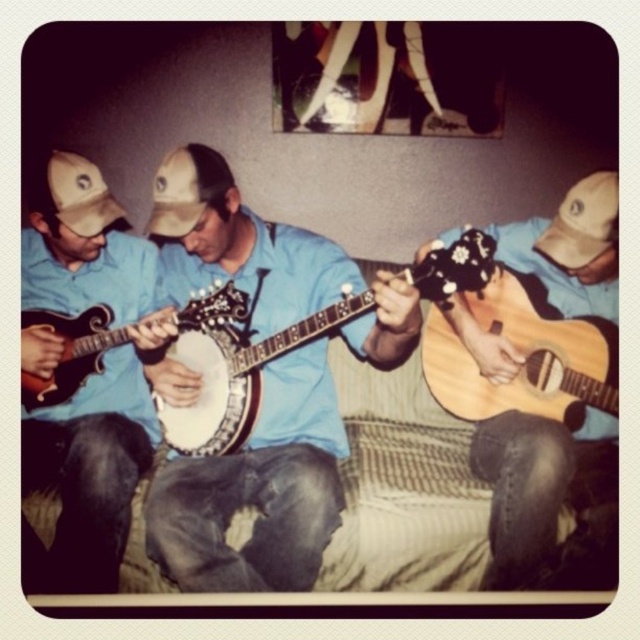
Does matte white banjo at center appear on the left side of tan fabric baseball cap at upper right?

Correct, you'll find matte white banjo at center to the left of tan fabric baseball cap at upper right.

Is point (36, 387) farther from camera compared to point (592, 225)?

That is True.

What do you see at coordinates (68, 353) in the screenshot? I see `matte white banjo at center` at bounding box center [68, 353].

Where is `matte white banjo at center`? Image resolution: width=640 pixels, height=640 pixels. matte white banjo at center is located at coordinates (68, 353).

Is wooden acoustic guitar at center thinner than tan fabric baseball cap at upper right?

Incorrect, wooden acoustic guitar at center's width is not less than tan fabric baseball cap at upper right's.

Between wooden acoustic guitar at center and tan fabric baseball cap at upper right, which one has less height?

Standing shorter between the two is tan fabric baseball cap at upper right.

Describe the element at coordinates (522, 490) in the screenshot. I see `wooden acoustic guitar at center` at that location.

Where is `wooden acoustic guitar at center`? The width and height of the screenshot is (640, 640). wooden acoustic guitar at center is located at coordinates (522, 490).

Which of these two, matte blue shirt at center or natural wood acoustic guitar at center, stands taller?

matte blue shirt at center is taller.

Does point (108, 356) come closer to viewer compared to point (486, 397)?

No, it is not.

Find the location of a particular element. The image size is (640, 640). matte blue shirt at center is located at coordinates (92, 468).